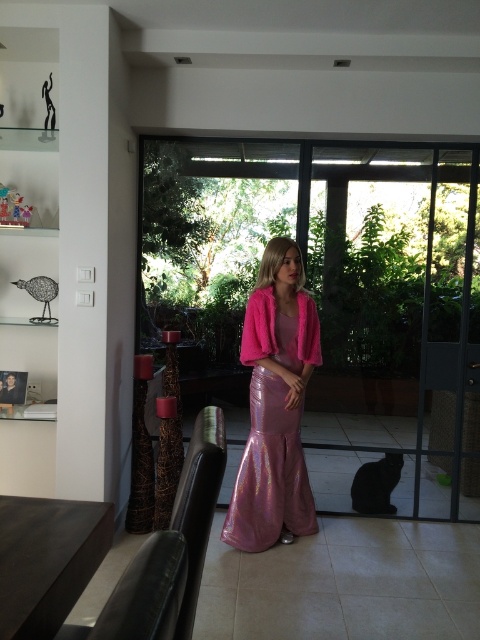
Who is positioned more to the right, transparent glass door at center or shiny pink dress at center?

Positioned to the right is transparent glass door at center.

Does transparent glass door at center have a smaller size compared to shiny pink dress at center?

No.

Which is behind, point (410, 218) or point (273, 404)?

The point (410, 218) is behind.

Locate an element on the screen. The image size is (480, 640). transparent glass door at center is located at coordinates (331, 284).